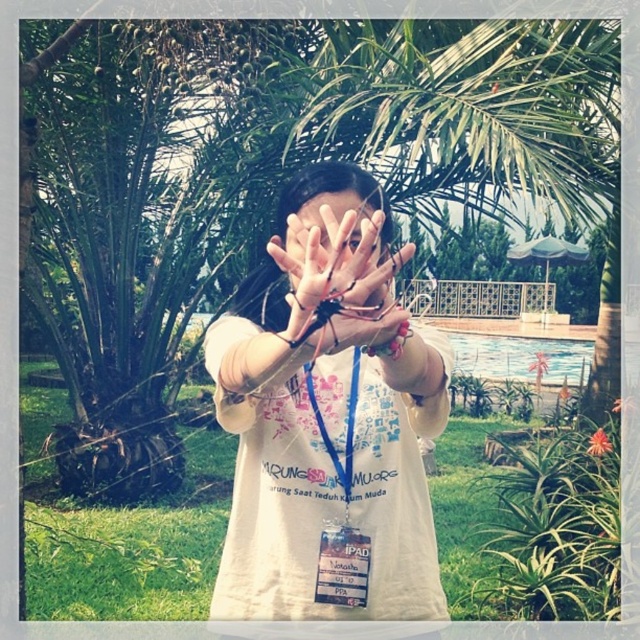
Based on the scene description, which object is taller between the green leafy palm tree at center and the matte skin hand at center?

The green leafy palm tree at center is taller than the matte skin hand at center.

You are a photographer trying to capture a clear photo of the palm tree in the scene. However, the person in the image has their hand positioned in a way that might block your view. Based on the scene description, can you determine if the matte skin hand at center is blocking the green leafy palm tree at center?

The matte skin hand at center is behind the green leafy palm tree at center, so the palm tree is not blocked by the hand.

Based on the scene description, can you determine the relative position of the green leafy palm tree at center and the white matte shirt at center from the observer perspective?

The green leafy palm tree at center is to the left of the white matte shirt at center from the observer perspective.